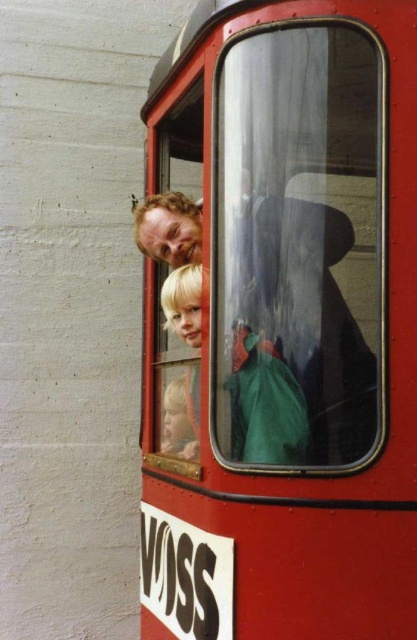
Is point (153, 353) closer to viewer compared to point (178, 394)?

That is False.

Can you confirm if metallic red train car at center is positioned above blonde hair child at center?

Indeed, metallic red train car at center is positioned over blonde hair child at center.

Where is `metallic red train car at center`? The height and width of the screenshot is (640, 417). metallic red train car at center is located at coordinates (283, 323).

At what (x,y) coordinates should I click in order to perform the action: click on metallic red train car at center. Please return your answer as a coordinate pair (x, y). This screenshot has width=417, height=640. Looking at the image, I should click on (283, 323).